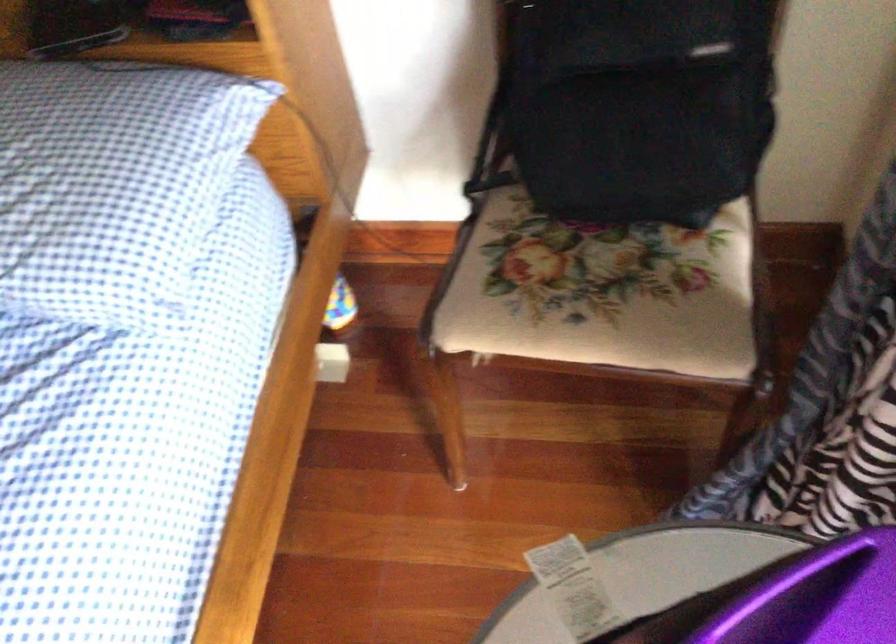
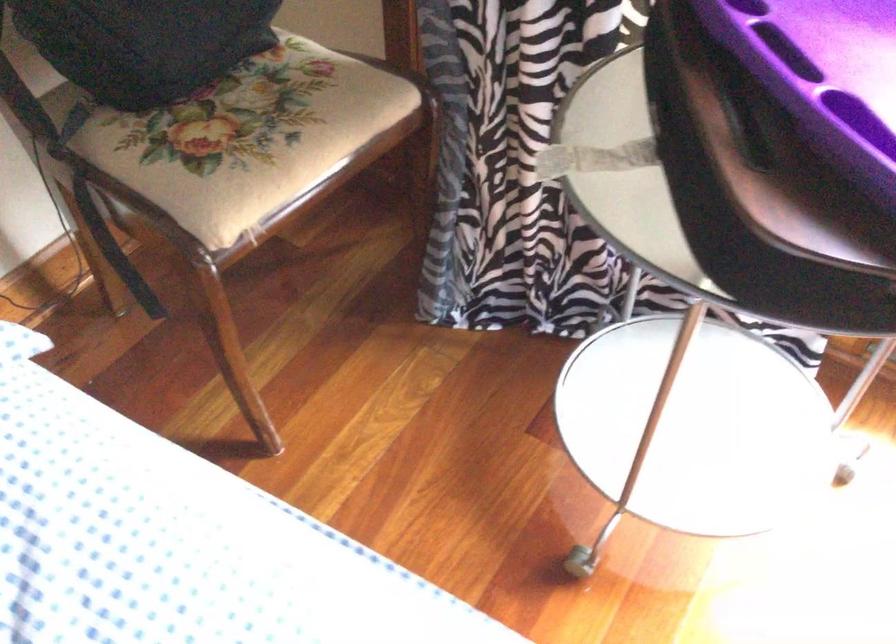
Question: Based on the continuous images, in which direction is the camera rotating? Reply with the corresponding letter.

Choices:
 (A) Left
 (B) Right
 (C) Up
 (D) Down

Answer: (B)